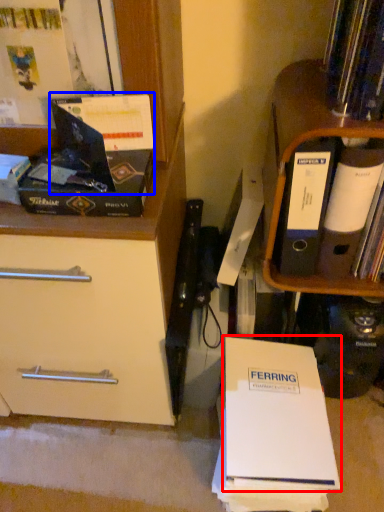
Question: Which object is closer to the camera taking this photo, paperback book (highlighted by a red box) or paperback book (highlighted by a blue box)?

Choices:
 (A) paperback book
 (B) paperback book

Answer: (B)